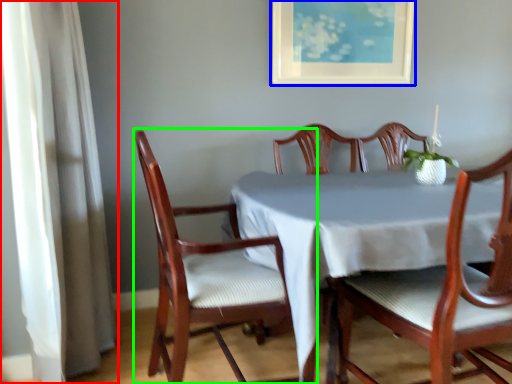
Question: Which object is the closest to the curtain (highlighted by a red box)? Choose among these: picture frame (highlighted by a blue box) or chair (highlighted by a green box).

Choices:
 (A) picture frame
 (B) chair

Answer: (B)